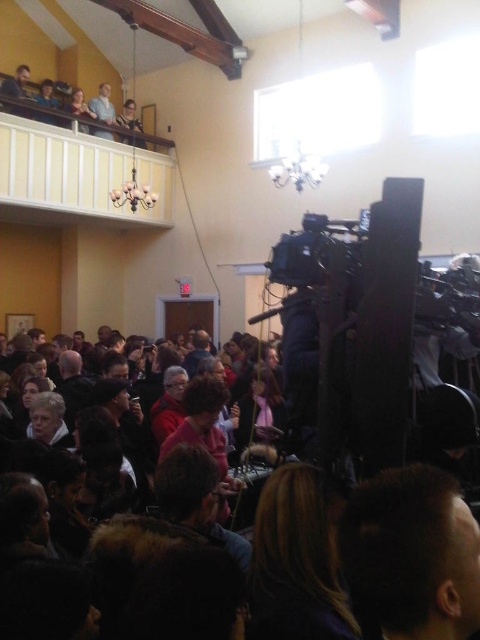
Based on the photo, can you confirm if light brown wooden chair at upper center is positioned to the left of matte black jacket at upper left?

In fact, light brown wooden chair at upper center is to the right of matte black jacket at upper left.

Is point (87, 106) more distant than point (45, 88)?

Yes, point (87, 106) is farther from viewer.

The width and height of the screenshot is (480, 640). What are the coordinates of `light brown wooden chair at upper center` in the screenshot? It's located at (103, 106).

The width and height of the screenshot is (480, 640). What are the coordinates of `light brown wooden chair at upper center` in the screenshot? It's located at (103, 106).

Based on the photo, is blonde hair at lower center bigger than matte black jacket at upper left?

No, blonde hair at lower center is not bigger than matte black jacket at upper left.

Find the location of a particular element. blonde hair at lower center is located at coordinates (296, 561).

From the picture: Is the position of dark brown hair at lower center more distant than that of matte black jacket at upper left?

No, dark brown hair at lower center is in front of matte black jacket at upper left.

Between dark brown hair at lower center and matte black jacket at upper left, which one is positioned higher?

matte black jacket at upper left

Locate an element on the screen. dark brown hair at lower center is located at coordinates (411, 554).